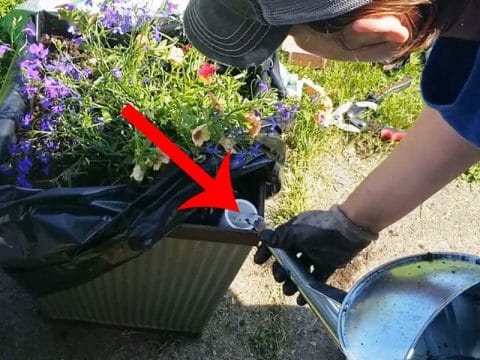
At what (x,y) coordinates should I click in order to perform the action: click on black trash bag. Please return your answer as a coordinate pair (x, y). The image size is (480, 360). Looking at the image, I should click on (112, 217).